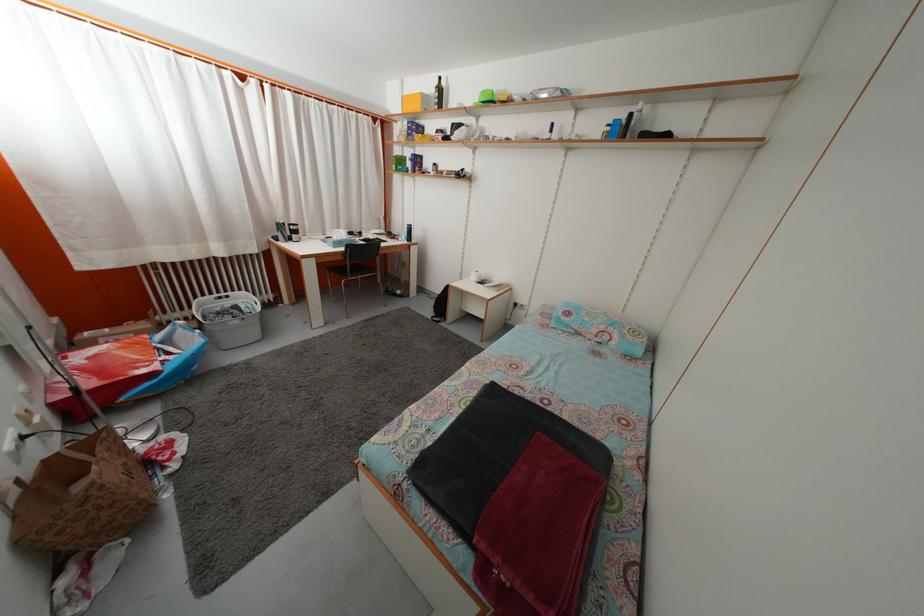
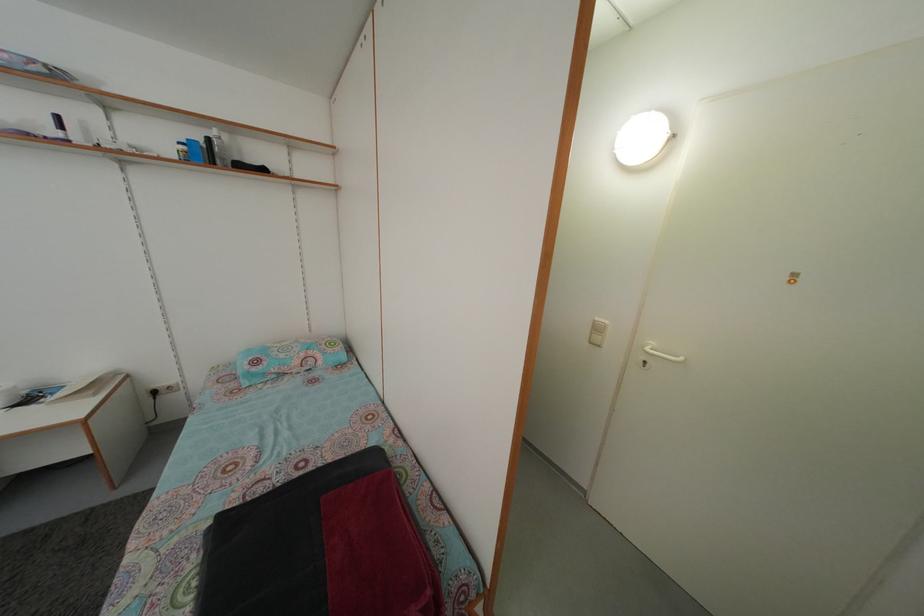
Question: The camera is either moving clockwise (left) or counter-clockwise (right) around the object. The first image is from the beginning of the video and the second image is from the end. Is the camera moving left or right when shooting the video?

Choices:
 (A) Left
 (B) Right

Answer: (A)